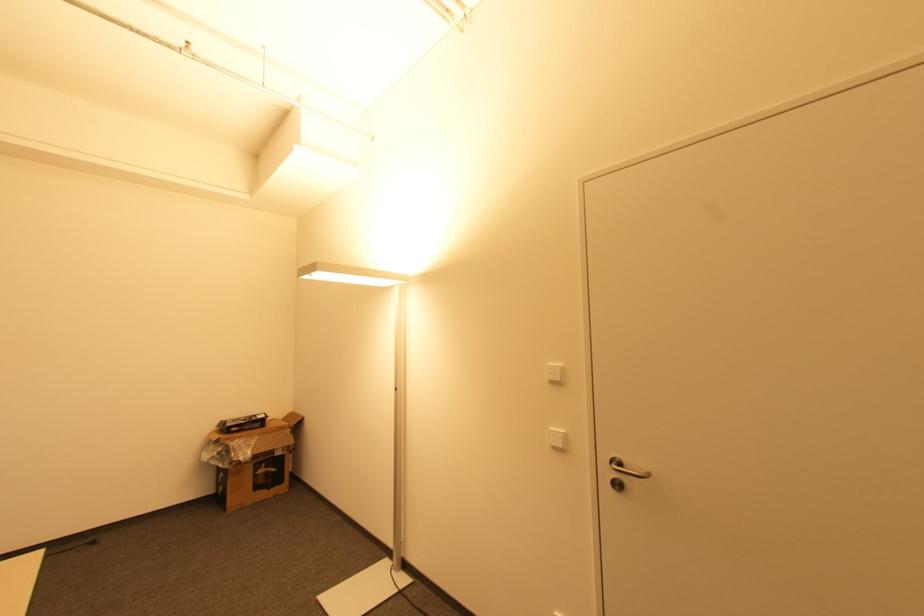
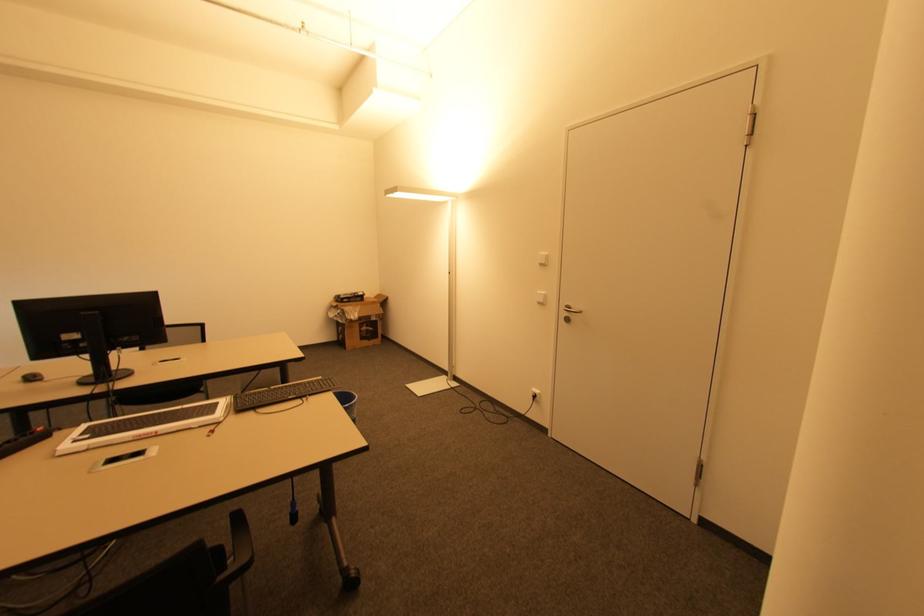
Find the pixel in the second image that matches [557,448] in the first image.

(541, 302)